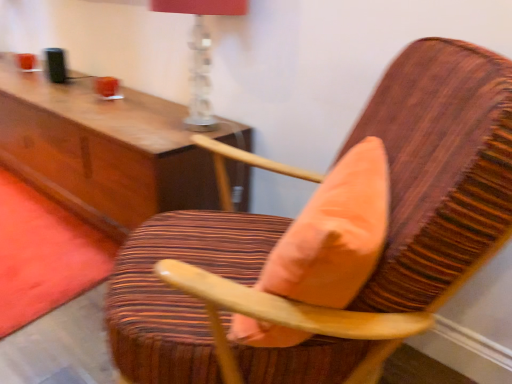
Question: From a real-world perspective, is wooden chair with striped upholstery at center located beneath translucent glass table lamp at upper center?

Choices:
 (A) no
 (B) yes

Answer: (B)

Question: Are wooden chair with striped upholstery at center and translucent glass table lamp at upper center making contact?

Choices:
 (A) no
 (B) yes

Answer: (A)

Question: Is wooden chair with striped upholstery at center thinner than translucent glass table lamp at upper center?

Choices:
 (A) no
 (B) yes

Answer: (A)

Question: Does wooden chair with striped upholstery at center come behind translucent glass table lamp at upper center?

Choices:
 (A) yes
 (B) no

Answer: (B)

Question: Is wooden chair with striped upholstery at center facing towards translucent glass table lamp at upper center?

Choices:
 (A) yes
 (B) no

Answer: (B)

Question: From the image's perspective, is coral velvet throw pillow at center positioned above or below translucent glass table lamp at upper center?

Choices:
 (A) above
 (B) below

Answer: (B)

Question: Considering the positions of coral velvet throw pillow at center and translucent glass table lamp at upper center in the image, is coral velvet throw pillow at center taller or shorter than translucent glass table lamp at upper center?

Choices:
 (A) tall
 (B) short

Answer: (B)

Question: From a real-world perspective, is coral velvet throw pillow at center physically located above or below translucent glass table lamp at upper center?

Choices:
 (A) below
 (B) above

Answer: (A)

Question: Is coral velvet throw pillow at center bigger or smaller than translucent glass table lamp at upper center?

Choices:
 (A) big
 (B) small

Answer: (B)

Question: In terms of width, does wooden chair with striped upholstery at center look wider or thinner when compared to translucent glass table lamp at upper center?

Choices:
 (A) wide
 (B) thin

Answer: (A)

Question: From the image's perspective, relative to translucent glass table lamp at upper center, is wooden chair with striped upholstery at center above or below?

Choices:
 (A) above
 (B) below

Answer: (B)

Question: Is wooden chair with striped upholstery at center situated inside translucent glass table lamp at upper center or outside?

Choices:
 (A) inside
 (B) outside

Answer: (B)

Question: From a real-world perspective, is wooden chair with striped upholstery at center positioned above or below translucent glass table lamp at upper center?

Choices:
 (A) below
 (B) above

Answer: (A)

Question: From their relative heights in the image, would you say coral velvet throw pillow at center is taller or shorter than wooden chair with striped upholstery at center?

Choices:
 (A) short
 (B) tall

Answer: (A)

Question: From the image's perspective, is coral velvet throw pillow at center above or below wooden chair with striped upholstery at center?

Choices:
 (A) above
 (B) below

Answer: (A)